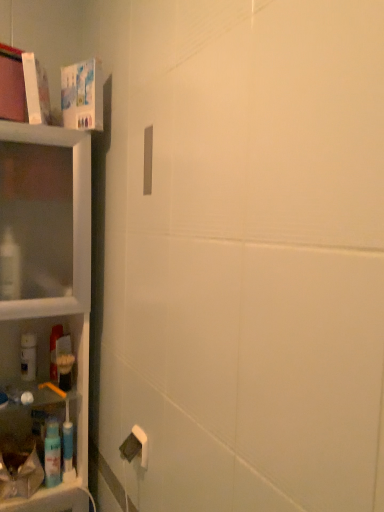
Question: Does clear plastic shelf at left have a lesser height compared to white matte bottle at left, which is counted as the 1th cleaning product, starting from the back?

Choices:
 (A) yes
 (B) no

Answer: (B)

Question: Is clear plastic shelf at left taller than white matte bottle at left, which is counted as the 1th cleaning product, starting from the back?

Choices:
 (A) yes
 (B) no

Answer: (A)

Question: Is the position of clear plastic shelf at left more distant than that of white matte bottle at left, placed as the first cleaning product when sorted from top to bottom?

Choices:
 (A) no
 (B) yes

Answer: (A)

Question: From the image's perspective, does clear plastic shelf at left appear higher than white matte bottle at left, which is the second cleaning product from bottom to top?

Choices:
 (A) yes
 (B) no

Answer: (A)

Question: Is clear plastic shelf at left to the right of white matte bottle at left, which is counted as the 1th cleaning product, starting from the back, from the viewer's perspective?

Choices:
 (A) no
 (B) yes

Answer: (B)

Question: Is clear plastic shelf at left wider than white matte bottle at left, the second cleaning product positioned from the right?

Choices:
 (A) no
 (B) yes

Answer: (B)

Question: Is blue plastic spray bottle at left, which ranks as the 2th cleaning product in top-to-bottom order, further to the viewer compared to white matte bottle at left, which is the second cleaning product from bottom to top?

Choices:
 (A) yes
 (B) no

Answer: (B)

Question: Is blue plastic spray bottle at left, placed as the second cleaning product when sorted from left to right, not close to white matte bottle at left, the second cleaning product positioned from the right?

Choices:
 (A) yes
 (B) no

Answer: (B)

Question: Can you confirm if blue plastic spray bottle at left, placed as the second cleaning product when sorted from left to right, is smaller than white matte bottle at left, placed as the first cleaning product when sorted from top to bottom?

Choices:
 (A) no
 (B) yes

Answer: (B)

Question: From a real-world perspective, is blue plastic spray bottle at left, placed as the second cleaning product when sorted from left to right, below white matte bottle at left, the second cleaning product positioned from the right?

Choices:
 (A) no
 (B) yes

Answer: (B)

Question: Is blue plastic spray bottle at left, which ranks as the 2th cleaning product in top-to-bottom order, at the left side of white matte bottle at left, which is the second cleaning product from bottom to top?

Choices:
 (A) yes
 (B) no

Answer: (B)

Question: Could you tell me if blue plastic spray bottle at left, which is the 1th cleaning product from bottom to top, is facing white matte bottle at left, the 1th cleaning product when ordered from left to right?

Choices:
 (A) yes
 (B) no

Answer: (B)

Question: Is translucent plastic mouthwash at lower left closer to the viewer compared to clear plastic shelf at left?

Choices:
 (A) no
 (B) yes

Answer: (A)